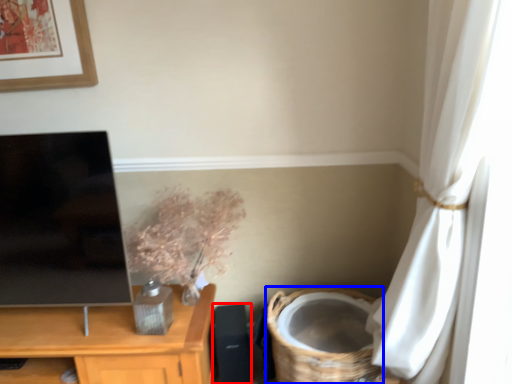
Question: Which point is closer to the camera, speaker (highlighted by a red box) or basket (highlighted by a blue box)?

Choices:
 (A) speaker
 (B) basket

Answer: (B)